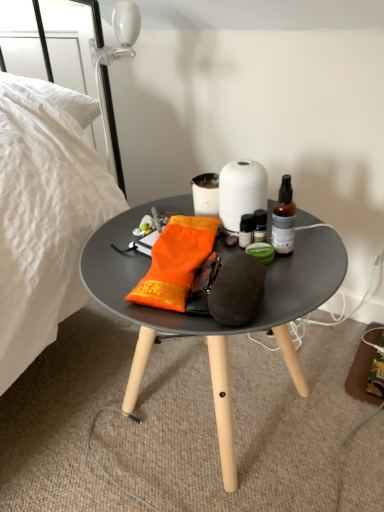
Locate an element on the screen. matte gray coffee table at center is located at coordinates (213, 319).

Is the depth of matte gray coffee table at center greater than that of orange fabric pouch at center?

No, the depth of matte gray coffee table at center is less than that of orange fabric pouch at center.

Is matte gray coffee table at center beside orange fabric pouch at center?

There is a gap between matte gray coffee table at center and orange fabric pouch at center.

From the image's perspective, does matte gray coffee table at center appear lower than orange fabric pouch at center?

Yes.

Between matte gray coffee table at center and orange fabric pouch at center, which one has smaller width?

Thinner between the two is orange fabric pouch at center.

From the image's perspective, which is below, brown glass bottle at center or orange fabric pouch at center?

orange fabric pouch at center.

Between brown glass bottle at center and orange fabric pouch at center, which one has less height?

orange fabric pouch at center is shorter.

Is point (282, 196) closer to viewer compared to point (182, 260)?

No, it is behind (182, 260).

At what (x,y) coordinates should I click in order to perform the action: click on paper towel above the matte gray coffee table at center (from a real-world perspective). Please return your answer as a coordinate pair (x, y). The image size is (384, 512). Looking at the image, I should click on (241, 192).

Are matte gray coffee table at center and white matte vase at center making contact?

No, matte gray coffee table at center is not next to white matte vase at center.

Is matte gray coffee table at center surrounding white matte vase at center?

That's incorrect, white matte vase at center is not inside matte gray coffee table at center.

Considering the sizes of objects matte gray coffee table at center and white matte vase at center in the image provided, who is bigger, matte gray coffee table at center or white matte vase at center?

Bigger between the two is matte gray coffee table at center.

Is orange fabric pouch at center facing towards matte gray coffee table at center?

No, orange fabric pouch at center is not turned towards matte gray coffee table at center.

From the image's perspective, which is above, orange fabric pouch at center or matte gray coffee table at center?

orange fabric pouch at center, from the image's perspective.

This screenshot has height=512, width=384. I want to click on coffee table to the right of orange fabric pouch at center, so click(213, 319).

Considering the positions of objects white matte vase at center and brown glass bottle at center in the image provided, who is behind, white matte vase at center or brown glass bottle at center?

Positioned behind is white matte vase at center.

Considering the sizes of objects white matte vase at center and brown glass bottle at center in the image provided, who is taller, white matte vase at center or brown glass bottle at center?

With more height is brown glass bottle at center.

How many degrees apart are the facing directions of white matte vase at center and brown glass bottle at center?

white matte vase at center and brown glass bottle at center are facing 4.17 degrees away from each other.

Consider the image. From a real-world perspective, who is located lower, white matte vase at center or brown glass bottle at center?

brown glass bottle at center, from a real-world perspective.

Is brown glass bottle at center at the left side of white matte vase at center?

No.

From a real-world perspective, is brown glass bottle at center over white matte vase at center?

No, from a real-world perspective, brown glass bottle at center is not above white matte vase at center.

In the scene shown: Is brown glass bottle at center not within white matte vase at center?

Yes, brown glass bottle at center is not within white matte vase at center.

Identify the location of paper towel above the brown glass bottle at center (from the image's perspective). This screenshot has width=384, height=512. (241, 192).

Can you confirm if white matte vase at center is positioned to the left of orange fabric pouch at center?

No, white matte vase at center is not to the left of orange fabric pouch at center.

Is white matte vase at center turned away from orange fabric pouch at center?

No, white matte vase at center is not facing the opposite direction of orange fabric pouch at center.

From a real-world perspective, does white matte vase at center stand above orange fabric pouch at center?

Indeed, from a real-world perspective, white matte vase at center stands above orange fabric pouch at center.

Is orange fabric pouch at center a part of white matte vase at center?

No, white matte vase at center does not contain orange fabric pouch at center.

Locate an element on the screen. The height and width of the screenshot is (512, 384). material behind the matte gray coffee table at center is located at coordinates coord(175,262).

You are a GUI agent. You are given a task and a screenshot of the screen. Output one action in this format:
    pyautogui.click(x=<x>, y=<y>)
    Task: Click on the material beneath the brown glass bottle at center (from a real-world perspective)
    The height and width of the screenshot is (512, 384).
    Given the screenshot: What is the action you would take?
    pyautogui.click(x=175, y=262)

Estimate the real-world distances between objects in this image. Which object is further from matte gray coffee table at center, white matte vase at center or orange fabric pouch at center?

The object further to matte gray coffee table at center is white matte vase at center.

Considering their positions, is orange fabric pouch at center positioned closer to brown glass bottle at center than matte gray coffee table at center?

orange fabric pouch at center is positioned closer to the anchor brown glass bottle at center.

From the image, which object appears to be nearer to white matte vase at center, matte gray coffee table at center or orange fabric pouch at center?

orange fabric pouch at center lies closer to white matte vase at center than the other object.

Considering their positions, is brown glass bottle at center positioned further to white matte vase at center than orange fabric pouch at center?

orange fabric pouch at center is positioned further to the anchor white matte vase at center.

Considering their positions, is white matte vase at center positioned closer to orange fabric pouch at center than matte gray coffee table at center?

white matte vase at center lies closer to orange fabric pouch at center than the other object.

Considering their positions, is matte gray coffee table at center positioned closer to brown glass bottle at center than orange fabric pouch at center?

orange fabric pouch at center is closer to brown glass bottle at center.

Based on the photo, estimate the real-world distances between objects in this image. Which object is further from brown glass bottle at center, matte gray coffee table at center or white matte vase at center?

matte gray coffee table at center.

In the scene shown: From the image, which object appears to be nearer to white matte vase at center, orange fabric pouch at center or matte gray coffee table at center?

orange fabric pouch at center is positioned closer to the anchor white matte vase at center.

The height and width of the screenshot is (512, 384). I want to click on paper towel between orange fabric pouch at center and brown glass bottle at center, so click(241, 192).

Where is `material between white matte vase at center and matte gray coffee table at center vertically`? The width and height of the screenshot is (384, 512). material between white matte vase at center and matte gray coffee table at center vertically is located at coordinates (175, 262).

This screenshot has height=512, width=384. What are the coordinates of `material between brown glass bottle at center and matte gray coffee table at center from top to bottom` in the screenshot? It's located at (175, 262).

Where is `bottle that lies between white matte vase at center and matte gray coffee table at center from top to bottom`? The image size is (384, 512). bottle that lies between white matte vase at center and matte gray coffee table at center from top to bottom is located at coordinates (284, 219).